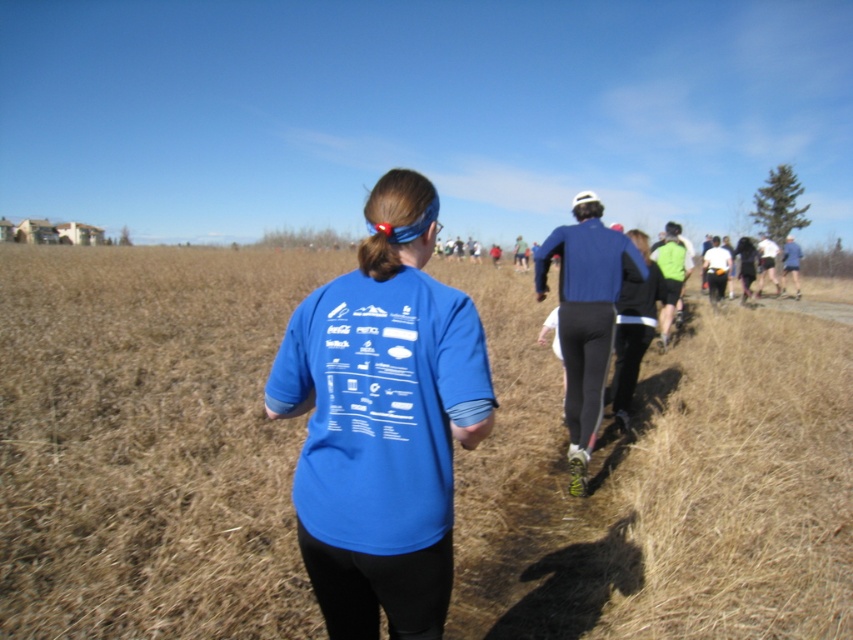
You are a photographer standing at the starting line of the running event. You want to take a photo that includes both the point at coordinates point (74, 504) and point (602, 272). Which point will appear larger in the photo?

Point (74, 504) is closer to the camera than point (602, 272), so it will appear larger in the photo.